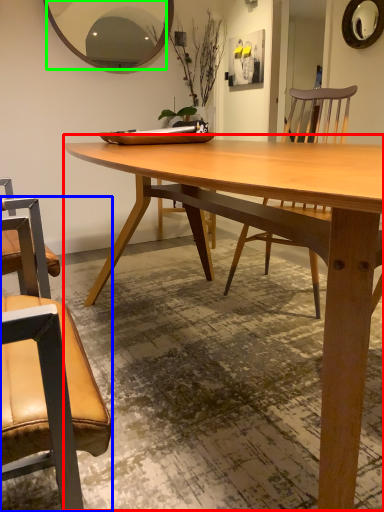
Question: Considering the real-world distances, which object is farthest from coffee table (highlighted by a red box)? chair (highlighted by a blue box) or mirror (highlighted by a green box)?

Choices:
 (A) chair
 (B) mirror

Answer: (B)